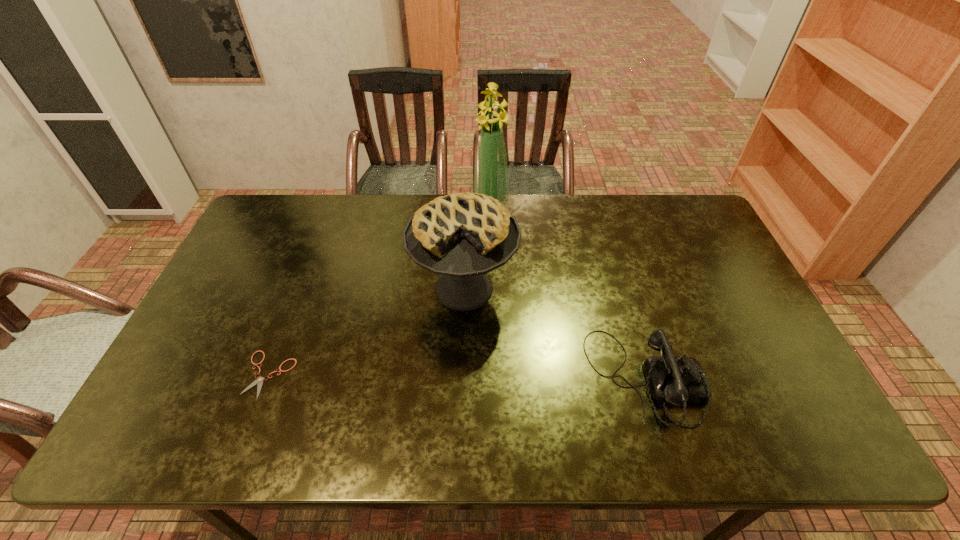
At what (x,y) coordinates should I click in order to perform the action: click on free space on the desktop that is between the leftmost object and the third tallest object and is positioned on the front-facing side of the bouquet. Please return your answer as a coordinate pair (x, y). The image size is (960, 540). Looking at the image, I should click on (455, 377).

Where is `free space on the desktop that is between the shears and the rightmost object and is positioned on the cut side of the third shortest object`? Image resolution: width=960 pixels, height=540 pixels. free space on the desktop that is between the shears and the rightmost object and is positioned on the cut side of the third shortest object is located at coordinates (412, 376).